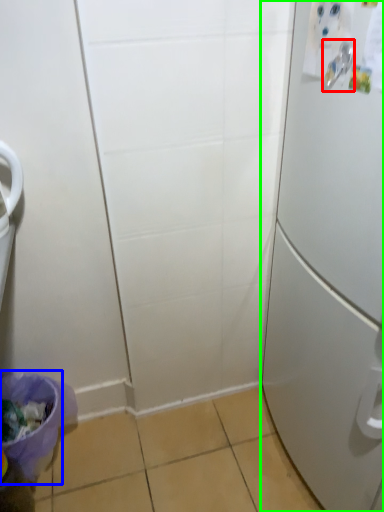
Question: Which object is the closest to the door handle (highlighted by a red box)? Choose among these: potty (highlighted by a blue box) or refrigerator (highlighted by a green box).

Choices:
 (A) potty
 (B) refrigerator

Answer: (B)